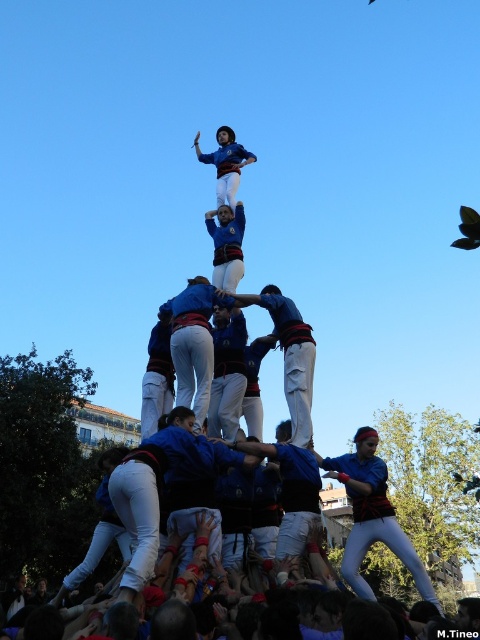
You are a safety inspector at the event and need to ensure the distance between the blue fabric at center and the blue fabric person at upper center is within the safety regulations. The regulation states that the minimum safe distance between any two participants should be at least 10 meters. Is the current distance compliant?

The distance between the blue fabric at center and the blue fabric person at upper center is 10.45 meters, which exceeds the minimum required 10 meters, so it is compliant with safety regulations.

You are a photographer at the event and want to capture the human tower. You notice the blue fabric person at center and the blue fabric at center. Which one is taller in the scene?

The blue fabric person at center is taller than the blue fabric at center.

You are a photographer standing in front of the human tower. You notice two blue fabric elements in the scene. One is the blue fabric person at center and the other is the blue fabric at center. Which one appears closer to you?

The blue fabric person at center is closer to the viewer than the blue fabric at center.